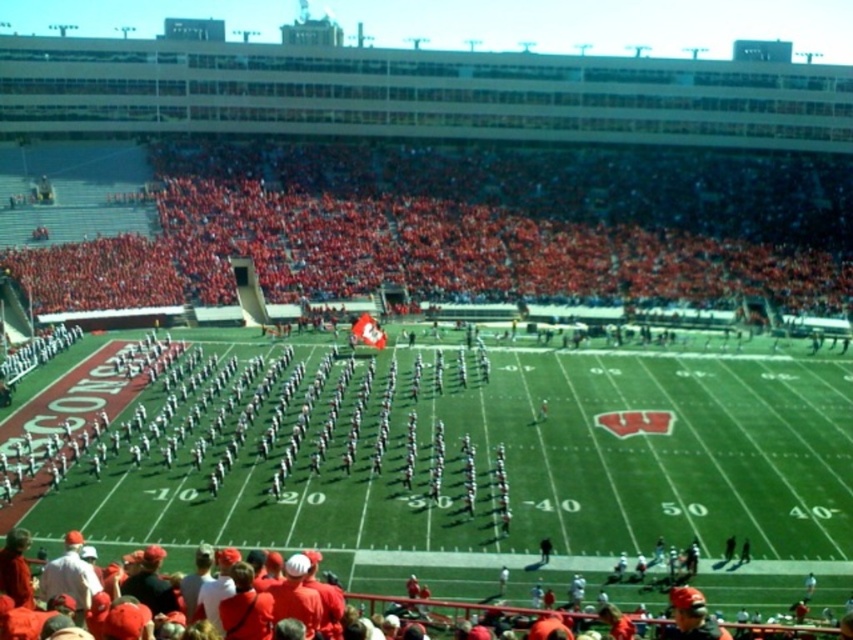
Does red fabric seats at upper center have a lesser width compared to white uniformed band at center?

No.

Who is taller, red fabric seats at upper center or white uniformed band at center?

red fabric seats at upper center is taller.

You are a GUI agent. You are given a task and a screenshot of the screen. Output one action in this format:
    pyautogui.click(x=<x>, y=<y>)
    Task: Click on the red fabric seats at upper center
    
    Given the screenshot: What is the action you would take?
    pyautogui.click(x=468, y=227)